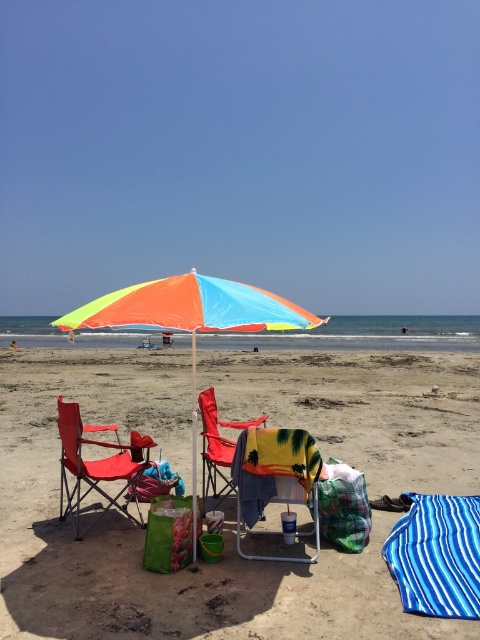
Question: Which object is positioned closest to the matte red beach chair at center?

Choices:
 (A) matte red beach chair at center-left
 (B) blue striped towel at lower right
 (C) beige sand at center
 (D) rainbow fabric umbrella at center

Answer: (A)

Question: Which point is farther to the camera?

Choices:
 (A) 32,584
 (B) 284,465

Answer: (B)

Question: Is beige sand at center positioned behind rainbow fabric umbrella at center?

Choices:
 (A) yes
 (B) no

Answer: (B)

Question: Which object is the closest to the matte red beach chair at center?

Choices:
 (A) yellow striped fabric beach chair at center
 (B) beige sand at center

Answer: (A)

Question: Is beige sand at center to the left of matte red beach chair at center-left from the viewer's perspective?

Choices:
 (A) yes
 (B) no

Answer: (B)

Question: Can you confirm if blue striped towel at lower right is smaller than yellow striped fabric beach chair at center?

Choices:
 (A) no
 (B) yes

Answer: (B)